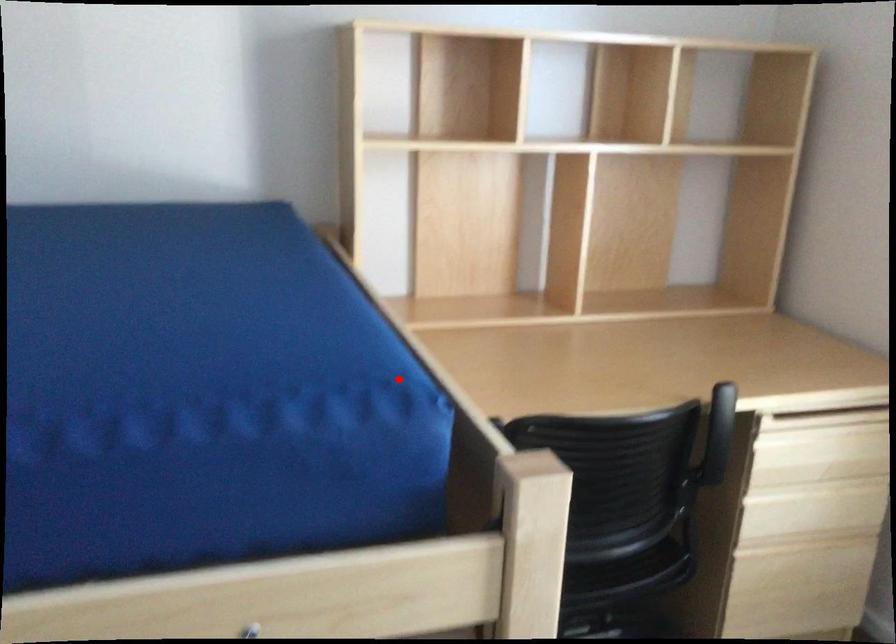
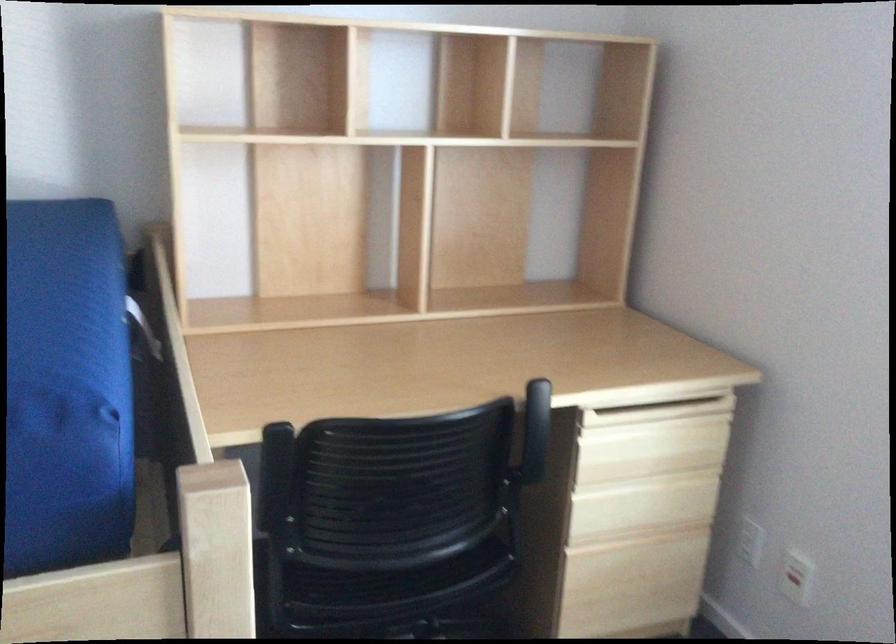
Find the pixel in the second image that matches the highlighted location in the first image.

(66, 388)